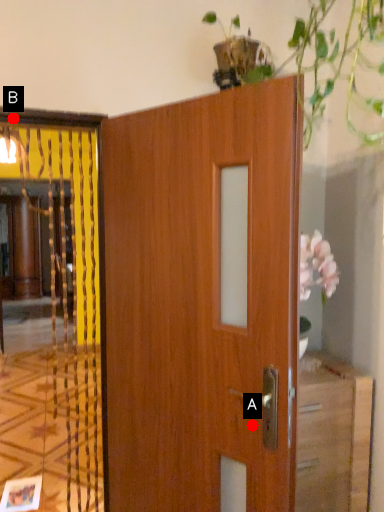
Question: Two points are circled on the image, labeled by A and B beside each circle. Which point is closer to the camera?

Choices:
 (A) A is closer
 (B) B is closer

Answer: (A)